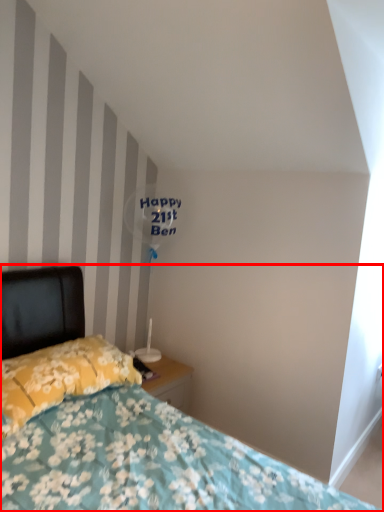
Question: From the image's perspective, what is the correct spatial relationship of bed (annotated by the red box) in relation to pillow?

Choices:
 (A) above
 (B) below

Answer: (B)